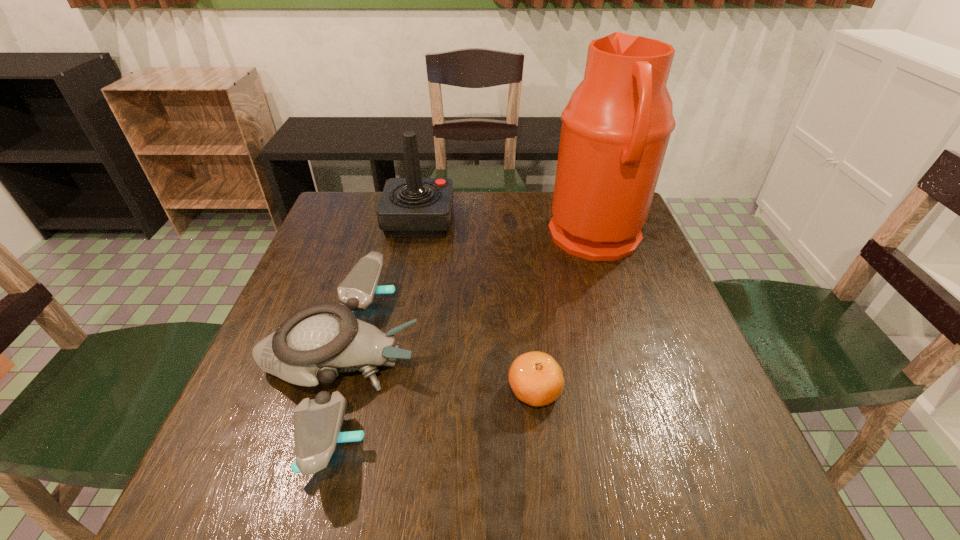
Find the location of a particular element. the tallest object is located at coordinates (616, 127).

Identify the location of the rightmost object. (616, 127).

Identify the location of joystick. (413, 206).

At what (x,y) coordinates should I click in order to perform the action: click on drone. Please return your answer as a coordinate pair (x, y). The height and width of the screenshot is (540, 960). Looking at the image, I should click on (316, 343).

You are a GUI agent. You are given a task and a screenshot of the screen. Output one action in this format:
    pyautogui.click(x=<x>, y=<y>)
    Task: Click on the clementine
    The height and width of the screenshot is (540, 960).
    Given the screenshot: What is the action you would take?
    pyautogui.click(x=535, y=377)

Identify the location of the shortest object. (535, 377).

Where is `free spot located 0.390m from the spout of the rightmost object`? The image size is (960, 540). free spot located 0.390m from the spout of the rightmost object is located at coordinates (408, 238).

The height and width of the screenshot is (540, 960). Find the location of `vacant space located from the spout of the rightmost object`. vacant space located from the spout of the rightmost object is located at coordinates (488, 238).

Where is `vacant area located 0.070m from the spout of the rightmost object`? The width and height of the screenshot is (960, 540). vacant area located 0.070m from the spout of the rightmost object is located at coordinates (524, 238).

At what (x,y) coordinates should I click in order to perform the action: click on free space located 0.370m on the front-facing side of the joystick. Please return your answer as a coordinate pair (x, y). Image resolution: width=960 pixels, height=540 pixels. Looking at the image, I should click on (580, 220).